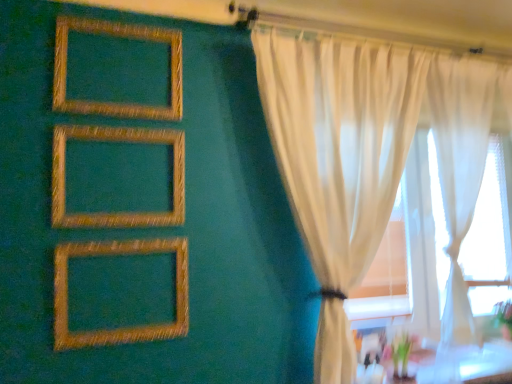
Question: Is gold textured picture frame at lower left, placed as the first picture frame when sorted from bottom to top, next to gold textured frame at center, which ranks as the second picture frame in bottom-to-top order, and touching it?

Choices:
 (A) no
 (B) yes

Answer: (A)

Question: From the image's perspective, would you say gold textured picture frame at lower left, placed as the first picture frame when sorted from bottom to top, is positioned over gold textured frame at center, placed as the second picture frame when sorted from top to bottom?

Choices:
 (A) yes
 (B) no

Answer: (B)

Question: Does gold textured picture frame at lower left, which is counted as the third picture frame, starting from the top, have a smaller size compared to gold textured frame at center, which ranks as the second picture frame in bottom-to-top order?

Choices:
 (A) no
 (B) yes

Answer: (A)

Question: Is gold textured frame at center, which ranks as the second picture frame in bottom-to-top order, surrounded by gold textured picture frame at lower left, placed as the first picture frame when sorted from bottom to top?

Choices:
 (A) no
 (B) yes

Answer: (A)

Question: From a real-world perspective, is gold textured picture frame at lower left, placed as the first picture frame when sorted from bottom to top, located higher than gold textured frame at center, placed as the second picture frame when sorted from top to bottom?

Choices:
 (A) yes
 (B) no

Answer: (B)

Question: Based on their sizes in the image, would you say gold textured frame at center, which ranks as the second picture frame in bottom-to-top order, is bigger or smaller than gold textured frame at upper left, acting as the 3th picture frame starting from the bottom?

Choices:
 (A) big
 (B) small

Answer: (B)

Question: Is gold textured frame at center, placed as the second picture frame when sorted from top to bottom, in front of or behind gold textured frame at upper left, acting as the 3th picture frame starting from the bottom, in the image?

Choices:
 (A) front
 (B) behind

Answer: (A)

Question: Does point (58, 195) appear closer or farther from the camera than point (179, 71)?

Choices:
 (A) farther
 (B) closer

Answer: (B)

Question: In the image, is gold textured frame at center, placed as the second picture frame when sorted from top to bottom, on the left side or the right side of gold textured frame at upper left, acting as the 3th picture frame starting from the bottom?

Choices:
 (A) right
 (B) left

Answer: (A)

Question: Is gold textured picture frame at lower left, which is counted as the third picture frame, starting from the top, to the left or to the right of gold textured frame at center, which ranks as the second picture frame in bottom-to-top order, in the image?

Choices:
 (A) left
 (B) right

Answer: (B)

Question: Is gold textured picture frame at lower left, which is counted as the third picture frame, starting from the top, inside the boundaries of gold textured frame at center, placed as the second picture frame when sorted from top to bottom, or outside?

Choices:
 (A) outside
 (B) inside

Answer: (A)

Question: Is point (181, 301) positioned closer to the camera than point (65, 185)?

Choices:
 (A) farther
 (B) closer

Answer: (A)

Question: Looking at their shapes, would you say gold textured picture frame at lower left, which is counted as the third picture frame, starting from the top, is wider or thinner than gold textured frame at center, placed as the second picture frame when sorted from top to bottom?

Choices:
 (A) thin
 (B) wide

Answer: (B)

Question: Is point (152, 223) positioned closer to the camera than point (497, 162)?

Choices:
 (A) farther
 (B) closer

Answer: (B)

Question: From a real-world perspective, is gold textured frame at center, placed as the second picture frame when sorted from top to bottom, above or below sheer white curtains at right?

Choices:
 (A) above
 (B) below

Answer: (A)